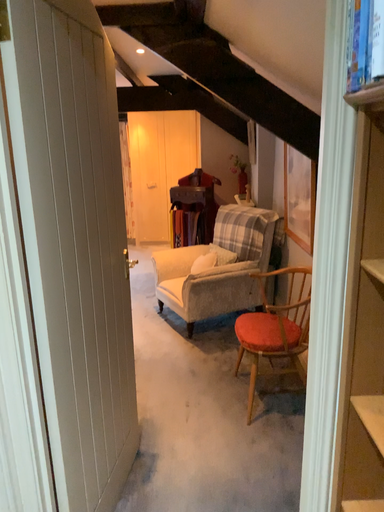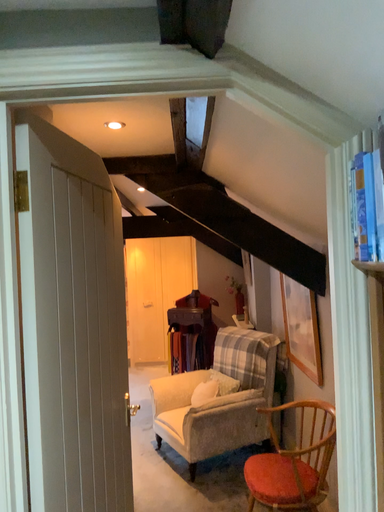
Question: How did the camera likely rotate when shooting the video?

Choices:
 (A) rotated downward
 (B) rotated upward

Answer: (B)